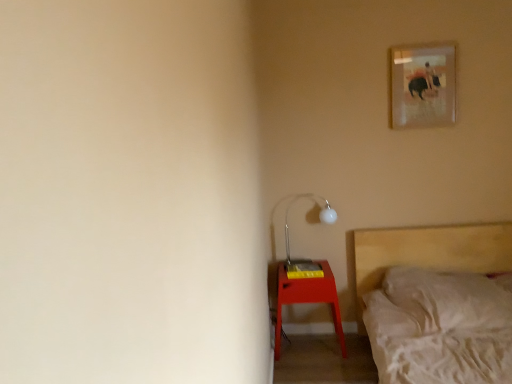
Question: Can matte white metal table lamp at lower right be found inside matte red nightstand at lower right?

Choices:
 (A) no
 (B) yes

Answer: (A)

Question: Would you say matte red nightstand at lower right is a long distance from matte white metal table lamp at lower right?

Choices:
 (A) yes
 (B) no

Answer: (B)

Question: Is matte red nightstand at lower right outside of matte white metal table lamp at lower right?

Choices:
 (A) no
 (B) yes

Answer: (B)

Question: Can you see matte red nightstand at lower right touching matte white metal table lamp at lower right?

Choices:
 (A) yes
 (B) no

Answer: (B)

Question: Is the position of matte red nightstand at lower right more distant than that of matte white metal table lamp at lower right?

Choices:
 (A) yes
 (B) no

Answer: (B)

Question: Is point (426, 230) closer or farther from the camera than point (314, 268)?

Choices:
 (A) farther
 (B) closer

Answer: (A)

Question: Considering the positions of wooden bed at lower right and matte white metal table lamp at lower right in the image, is wooden bed at lower right taller or shorter than matte white metal table lamp at lower right?

Choices:
 (A) short
 (B) tall

Answer: (B)

Question: Looking at their shapes, would you say wooden bed at lower right is wider or thinner than matte white metal table lamp at lower right?

Choices:
 (A) wide
 (B) thin

Answer: (A)

Question: From a real-world perspective, is wooden bed at lower right above or below matte white metal table lamp at lower right?

Choices:
 (A) below
 (B) above

Answer: (A)

Question: Considering the positions of matte glass picture frame at upper right and wooden bed at lower right in the image, is matte glass picture frame at upper right taller or shorter than wooden bed at lower right?

Choices:
 (A) short
 (B) tall

Answer: (A)

Question: Considering the positions of point (439, 124) and point (458, 236), is point (439, 124) closer or farther from the camera than point (458, 236)?

Choices:
 (A) farther
 (B) closer

Answer: (B)

Question: From a real-world perspective, is matte glass picture frame at upper right above or below wooden bed at lower right?

Choices:
 (A) below
 (B) above

Answer: (B)

Question: From the image's perspective, is matte glass picture frame at upper right positioned above or below wooden bed at lower right?

Choices:
 (A) above
 (B) below

Answer: (A)

Question: Looking at their shapes, would you say matte red nightstand at lower right is wider or thinner than matte white metal table lamp at lower right?

Choices:
 (A) wide
 (B) thin

Answer: (A)

Question: From their relative heights in the image, would you say matte red nightstand at lower right is taller or shorter than matte white metal table lamp at lower right?

Choices:
 (A) short
 (B) tall

Answer: (B)